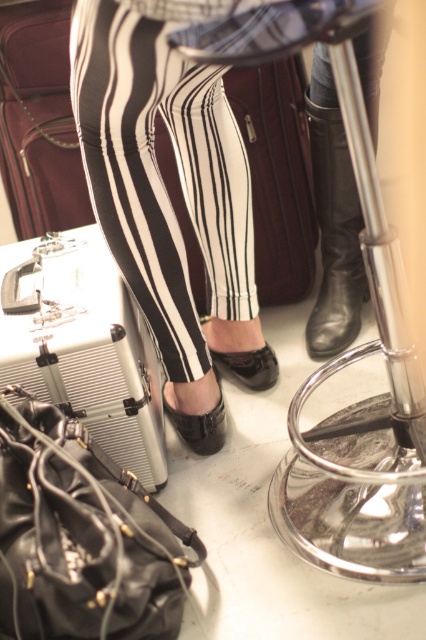
Which is more to the right, shiny metallic bar stool at center or shiny black boot at center?

Positioned to the right is shiny black boot at center.

Is shiny metallic bar stool at center above shiny black boot at center?

Incorrect, shiny metallic bar stool at center is not positioned above shiny black boot at center.

Describe the element at coordinates (360, 412) in the screenshot. This screenshot has width=426, height=640. I see `shiny metallic bar stool at center` at that location.

Find the location of a particular element. shiny metallic bar stool at center is located at coordinates (360, 412).

Who is positioned more to the right, black leather bag at lower left or shiny black boot at center?

Positioned to the right is shiny black boot at center.

What do you see at coordinates (83, 538) in the screenshot? The image size is (426, 640). I see `black leather bag at lower left` at bounding box center [83, 538].

Find the location of a particular element. black leather bag at lower left is located at coordinates (83, 538).

Identify the location of black leather bag at lower left. This screenshot has width=426, height=640. (83, 538).

Between black leather bag at lower left and matte brown suitcase at left, which one has more height?

Standing taller between the two is matte brown suitcase at left.

Who is more forward, (19, 493) or (28, 147)?

Point (19, 493)

Identify the location of black leather bag at lower left. This screenshot has height=640, width=426. (83, 538).